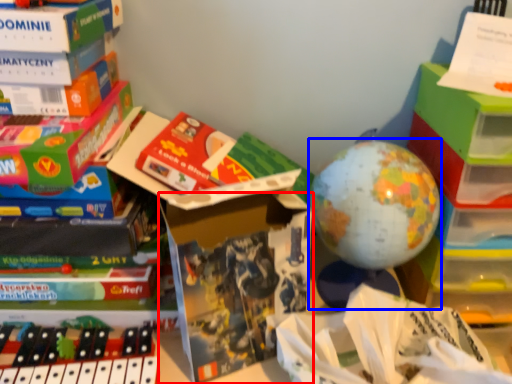
Question: Which point is closer to the camera, paperback book (highlighted by a red box) or toy (highlighted by a blue box)?

Choices:
 (A) paperback book
 (B) toy

Answer: (A)